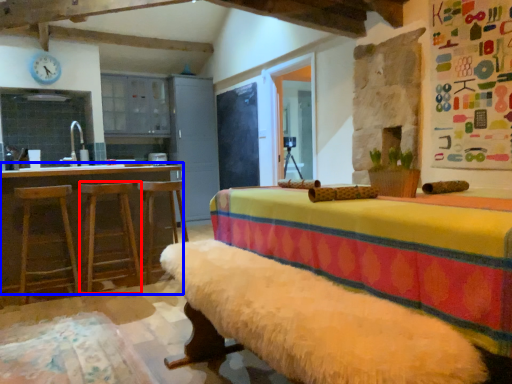
Question: Among these objects, which one is farthest to the camera, bar stool (highlighted by a red box) or table (highlighted by a blue box)?

Choices:
 (A) bar stool
 (B) table

Answer: (A)